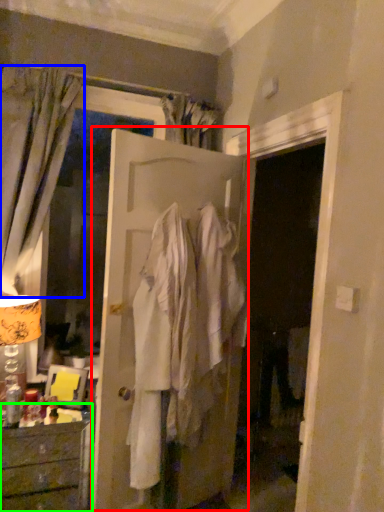
Question: Based on their relative distances, which object is farther from door (highlighted by a red box)? Choose from curtain (highlighted by a blue box) and chest of drawers (highlighted by a green box).

Choices:
 (A) curtain
 (B) chest of drawers

Answer: (B)